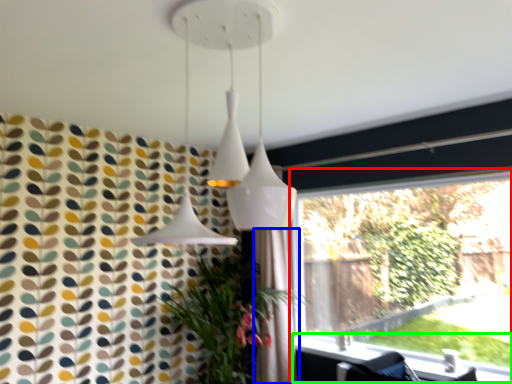
Question: Which object is the closest to the window (highlighted by a red box)? Choose among these: shower curtain (highlighted by a blue box) or window sill (highlighted by a green box).

Choices:
 (A) shower curtain
 (B) window sill

Answer: (B)